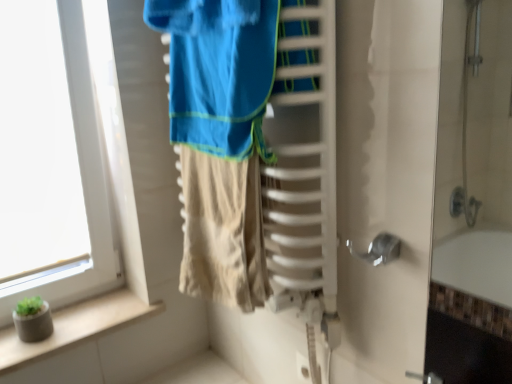
Question: Can you confirm if white glass window at left is shorter than white plastic electric outlet at lower center?

Choices:
 (A) yes
 (B) no

Answer: (B)

Question: From a real-world perspective, is white glass window at left physically below white plastic electric outlet at lower center?

Choices:
 (A) no
 (B) yes

Answer: (A)

Question: Can you confirm if white glass window at left is wider than white plastic electric outlet at lower center?

Choices:
 (A) yes
 (B) no

Answer: (A)

Question: From a real-world perspective, is white glass window at left physically above white plastic electric outlet at lower center?

Choices:
 (A) no
 (B) yes

Answer: (B)

Question: Is white glass window at left beside white plastic electric outlet at lower center?

Choices:
 (A) yes
 (B) no

Answer: (B)

Question: In terms of height, does green concrete planter at lower left look taller or shorter compared to white glass window at left?

Choices:
 (A) short
 (B) tall

Answer: (A)

Question: From the image's perspective, is green concrete planter at lower left positioned above or below white glass window at left?

Choices:
 (A) below
 (B) above

Answer: (A)

Question: Considering the positions of point (74, 344) and point (90, 86), is point (74, 344) closer or farther from the camera than point (90, 86)?

Choices:
 (A) closer
 (B) farther

Answer: (A)

Question: Considering the relative positions of green concrete planter at lower left and white glass window at left in the image provided, is green concrete planter at lower left to the left or to the right of white glass window at left?

Choices:
 (A) left
 (B) right

Answer: (B)

Question: In terms of height, does white glass window at left look taller or shorter compared to green concrete planter at lower left?

Choices:
 (A) tall
 (B) short

Answer: (A)

Question: From the image's perspective, relative to green concrete planter at lower left, is white glass window at left above or below?

Choices:
 (A) below
 (B) above

Answer: (B)

Question: From a real-world perspective, is white glass window at left positioned above or below green concrete planter at lower left?

Choices:
 (A) below
 (B) above

Answer: (B)

Question: Considering the positions of white glass window at left and green concrete planter at lower left in the image, is white glass window at left bigger or smaller than green concrete planter at lower left?

Choices:
 (A) small
 (B) big

Answer: (B)

Question: Looking at the image, does white glass window at left seem bigger or smaller compared to white plastic electric outlet at lower center?

Choices:
 (A) small
 (B) big

Answer: (B)

Question: Is white glass window at left wider or thinner than white plastic electric outlet at lower center?

Choices:
 (A) wide
 (B) thin

Answer: (A)